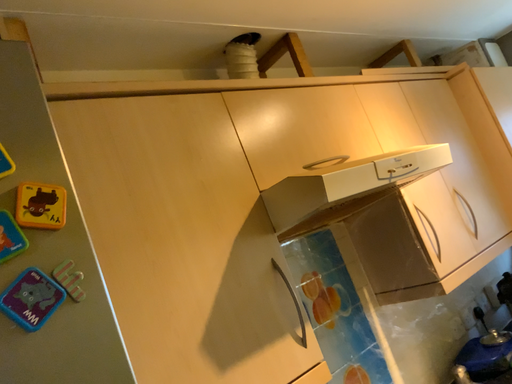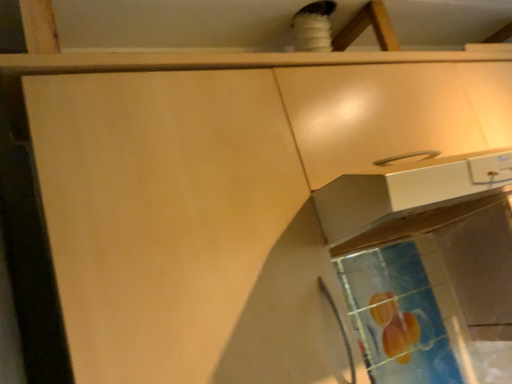
Question: How did the camera likely rotate when shooting the video?

Choices:
 (A) rotated right
 (B) rotated left

Answer: (B)